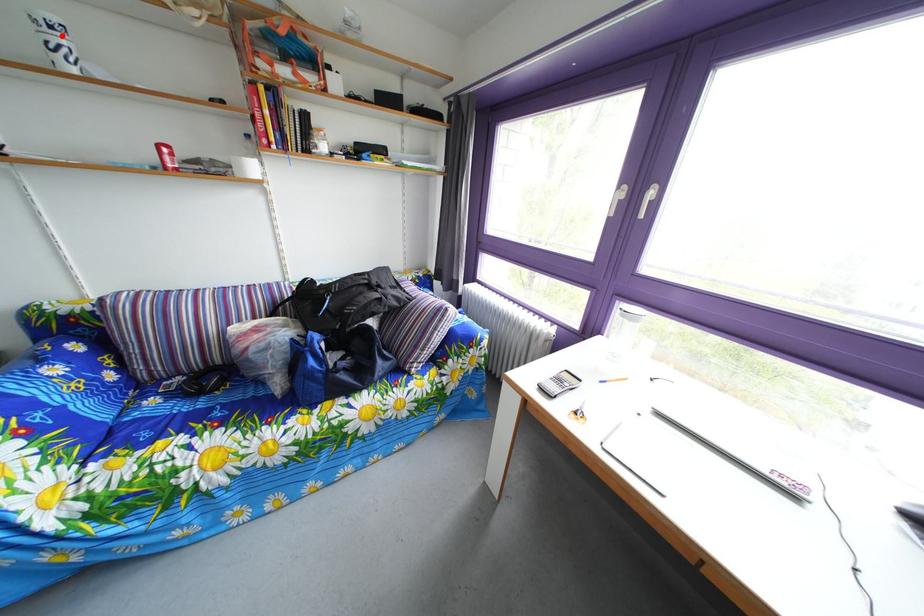
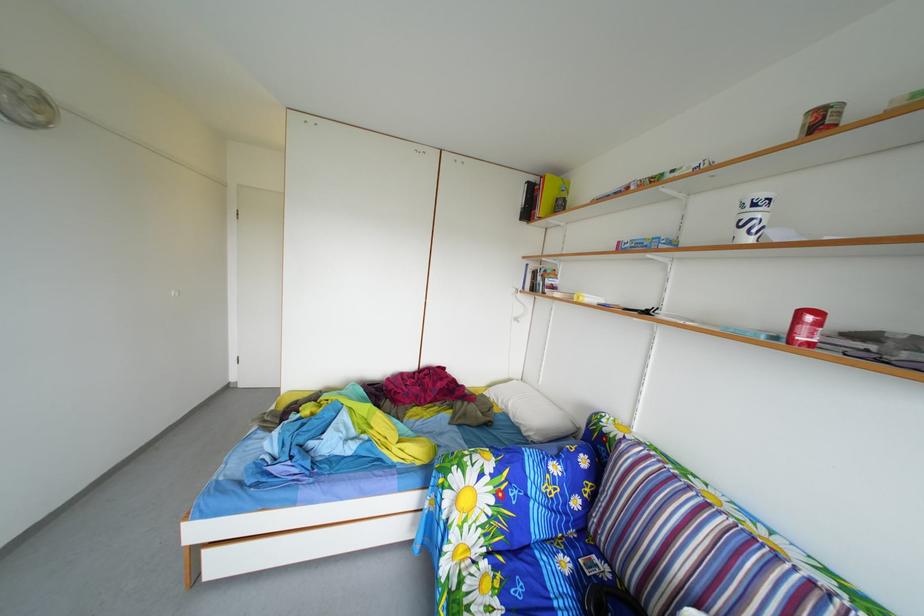
Question: A red point is marked in image1. In image2, is the corresponding 3D point closer to the camera or farther? Reply with the corresponding letter.

Choices:
 (A) The corresponding 3D point is closer.
 (B) The corresponding 3D point is farther.

Answer: (A)